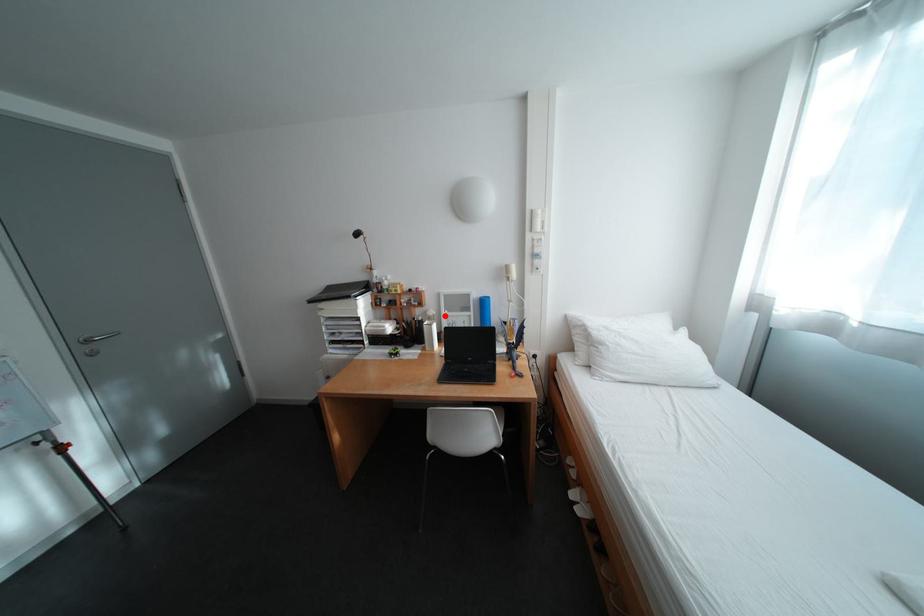
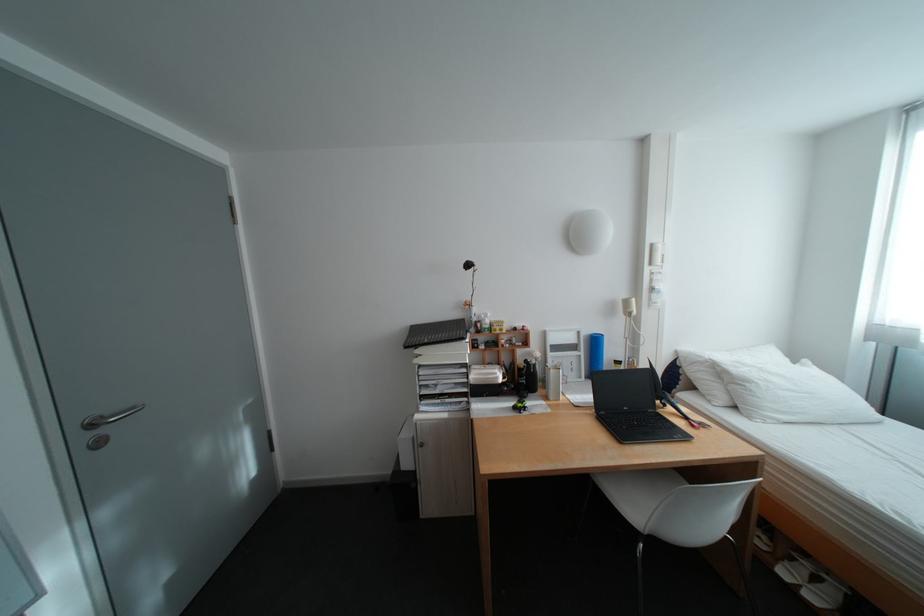
Find the pixel in the second image that matches the highlighted location in the first image.

(552, 358)